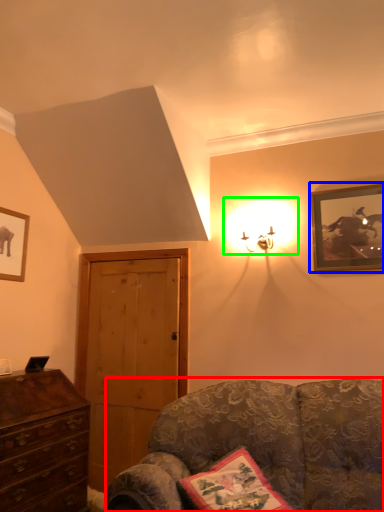
Question: Based on their relative distances, which object is nearer to studio couch (highlighted by a red box)? Choose from picture frame (highlighted by a blue box) and light (highlighted by a green box).

Choices:
 (A) picture frame
 (B) light

Answer: (A)